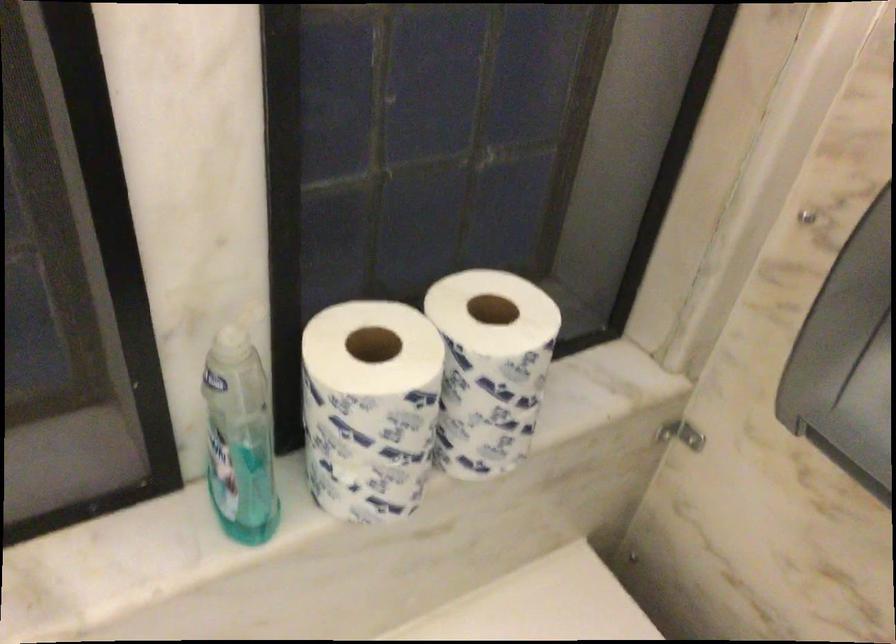
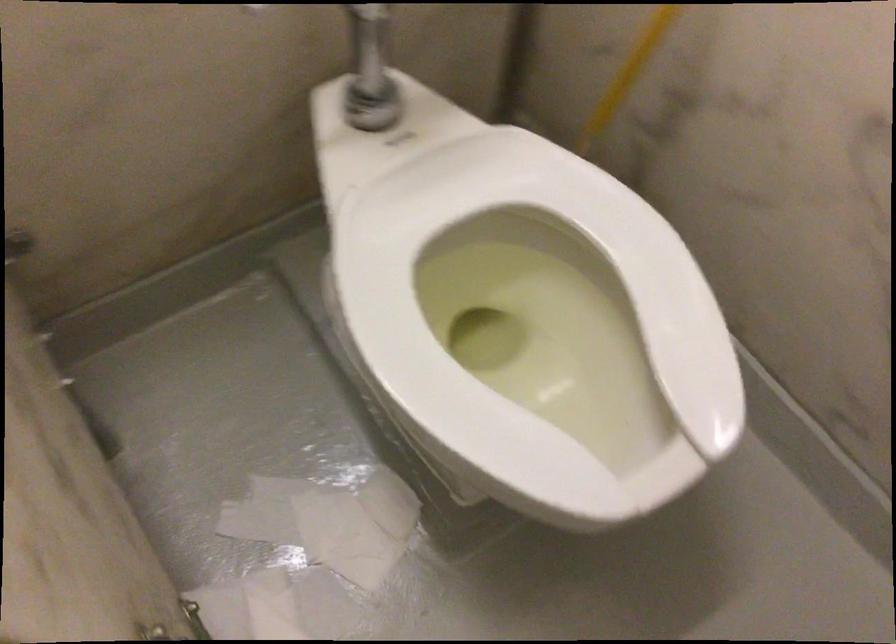
Which direction would the cameraman need to move to produce the second image?

The cameraman moved toward right, forward.